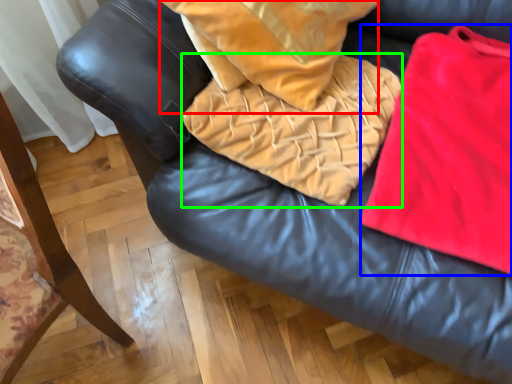
Question: Which object is positioned closest to throw pillow (highlighted by a red box)? Select from cloth (highlighted by a blue box) and blanket (highlighted by a green box).

Choices:
 (A) cloth
 (B) blanket

Answer: (B)